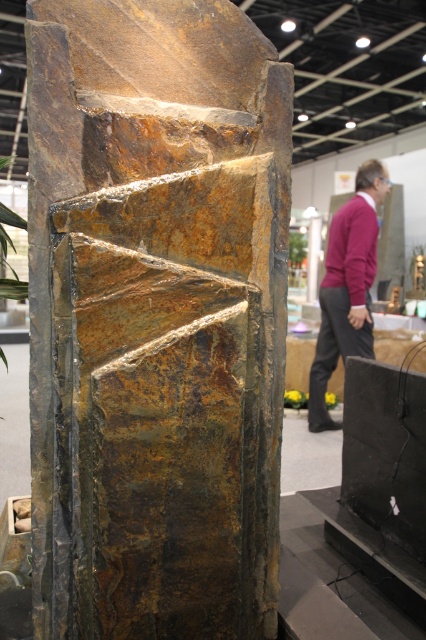
Which is behind, point (160, 340) or point (310, 385)?

The point (310, 385) is more distant.

The width and height of the screenshot is (426, 640). Find the location of `rusty stone sculpture at center`. rusty stone sculpture at center is located at coordinates (155, 317).

Is point (31, 58) positioned in front of point (362, 221)?

Yes, it is.

The width and height of the screenshot is (426, 640). Identify the location of rusty stone sculpture at center. (155, 317).